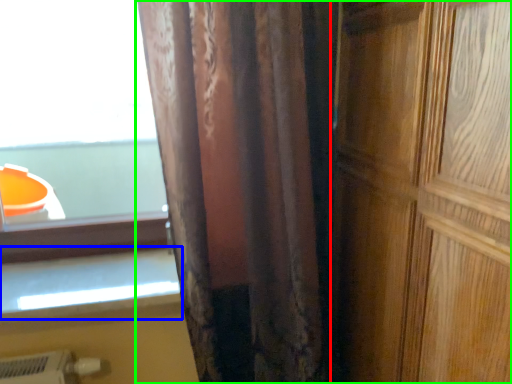
Question: Which object is positioned closest to door (highlighted by a red box)? Select from window sill (highlighted by a blue box) and curtain (highlighted by a green box).

Choices:
 (A) window sill
 (B) curtain

Answer: (B)